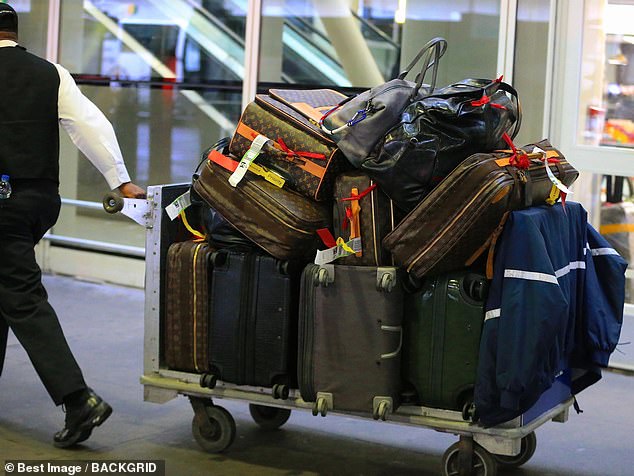
Image resolution: width=634 pixels, height=476 pixels. In order to click on wheels of luggage cart in this screenshot , I will do `click(219, 438)`, `click(267, 419)`, `click(450, 459)`, `click(527, 448)`.